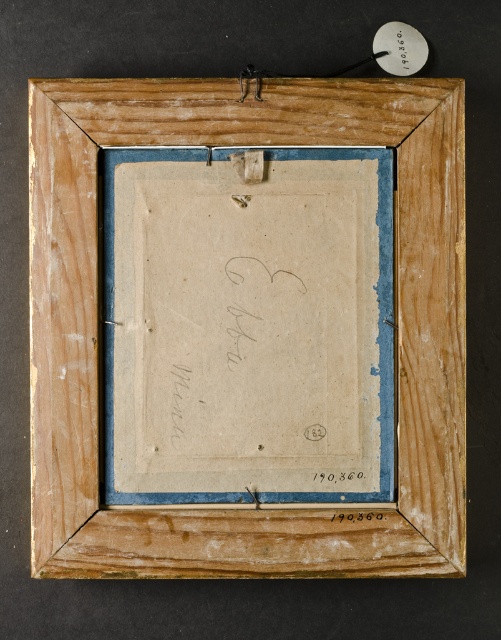
Based on the photo, you are an art conservator examining the back of a wooden picture frame. You notice a black ink signature at center. Given that the wooden picture frame at center is larger than the signature, can you determine if the signature is entirely within the frame?

The wooden picture frame at center is bigger than the black ink signature at center, so the signature is entirely within the frame.

From the picture: You are an art conservator examining the back of a wooden picture frame. You notice there are two items at the center. What is the relationship between the wooden picture frame at center and the black ink signature at center?

The wooden picture frame at center is positioned over the black ink signature at center, meaning the signature is underneath the frame.